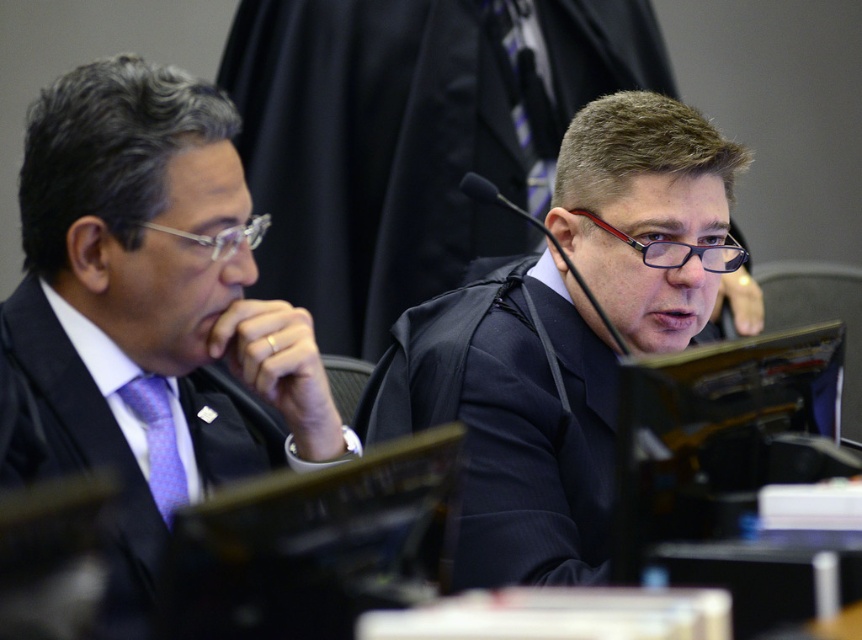
Can you confirm if matte black suit at left is positioned above black fabric judge at center?

Correct, matte black suit at left is located above black fabric judge at center.

Can you confirm if matte black suit at left is positioned to the right of black fabric judge at center?

No, matte black suit at left is not to the right of black fabric judge at center.

Is point (77, 314) closer to camera compared to point (679, 140)?

Yes.

Where is `matte black suit at left`? matte black suit at left is located at coordinates (147, 310).

Does matte black suit at left have a greater width compared to purple textured tie at left?

Correct, the width of matte black suit at left exceeds that of purple textured tie at left.

Who is more distant from viewer, (245, 326) or (166, 467)?

Positioned behind is point (166, 467).

This screenshot has width=862, height=640. Identify the location of matte black suit at left. pyautogui.click(x=147, y=310).

Between black fabric judge at center and purple textured tie at left, which one is positioned lower?

purple textured tie at left is below.

The image size is (862, 640). What do you see at coordinates (511, 419) in the screenshot? I see `black fabric judge at center` at bounding box center [511, 419].

I want to click on black fabric judge at center, so click(511, 419).